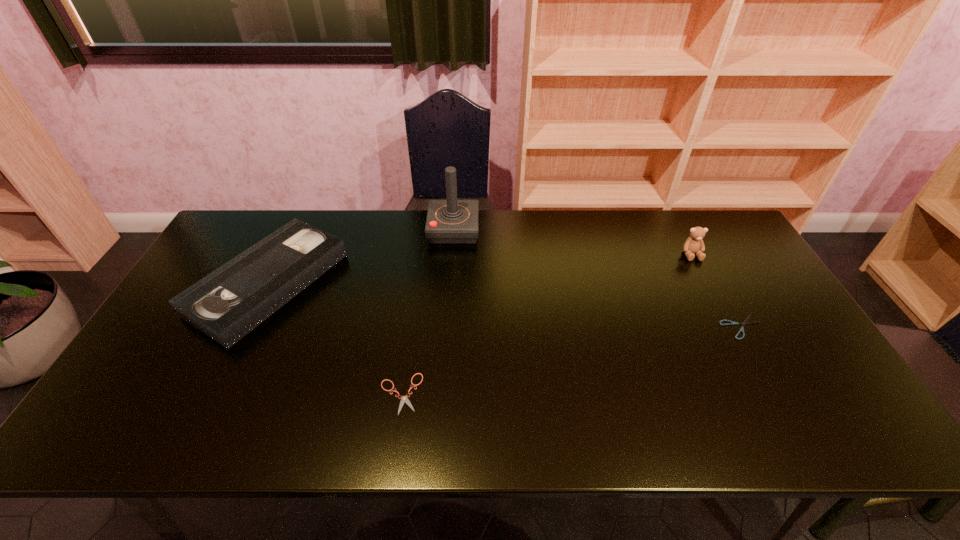
Locate an element on the screen. free space that satisfies the following two spatial constraints: 1. on the face of the farther shears; 2. on the left side of the teddy bear is located at coordinates pyautogui.click(x=730, y=327).

At what (x,y) coordinates should I click in order to perform the action: click on free space that satisfies the following two spatial constraints: 1. on the front side of the videotape; 2. on the left side of the farther shears. Please return your answer as a coordinate pair (x, y). The image size is (960, 540). Looking at the image, I should click on (248, 327).